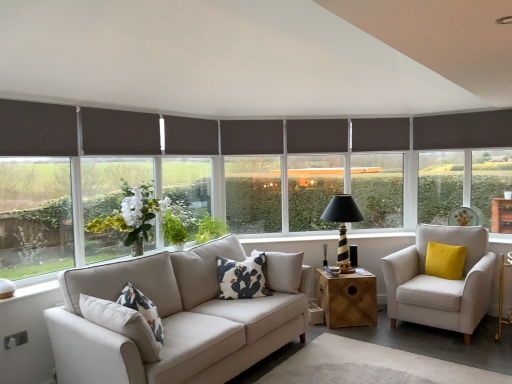
Measure the distance between point [244,283] and camera.

Point [244,283] and camera are 3.66 meters apart.

What are the coordinates of `white matte vase at center` in the screenshot? It's located at (132, 214).

In order to click on dark gray roller blind at center, the 2th window screen when ordered from left to right in this screenshot , I will do `click(253, 194)`.

In the image, is light beige fabric armchair at right on the left side or the right side of yellow velvet pillow at right, which is the first pillow in back-to-front order?

Based on their positions, light beige fabric armchair at right is located to the left of yellow velvet pillow at right, which is the first pillow in back-to-front order.

The width and height of the screenshot is (512, 384). I want to click on pillow located on the right of light beige fabric armchair at right, so click(x=445, y=260).

Is light beige fabric armchair at right turned away from yellow velvet pillow at right, which appears as the second pillow when viewed from the left?

Yes, yellow velvet pillow at right, which appears as the second pillow when viewed from the left, is at the back of light beige fabric armchair at right.

Who is taller, white cotton cushion at center, acting as the first pillow starting from the left, or wooden cube at center?

Standing taller between the two is white cotton cushion at center, acting as the first pillow starting from the left.

From a real-world perspective, between white cotton cushion at center, acting as the first pillow starting from the left, and wooden cube at center, who is vertically lower?

wooden cube at center is physically lower.

Based on the photo, which is closer to the camera, (241, 285) or (362, 280)?

Point (241, 285) is positioned closer to the camera compared to point (362, 280).

Is white cotton cushion at center, the 2th pillow positioned from the right, situated inside wooden cube at center or outside?

white cotton cushion at center, the 2th pillow positioned from the right, is outside wooden cube at center.

In the image, is yellow velvet pillow at right, the first pillow viewed from the right, positioned in front of or behind black striped wood table lamp at center?

yellow velvet pillow at right, the first pillow viewed from the right, is in front of black striped wood table lamp at center.

From the image's perspective, which one is positioned lower, yellow velvet pillow at right, which appears as the second pillow when viewed from the left, or black striped wood table lamp at center?

yellow velvet pillow at right, which appears as the second pillow when viewed from the left, from the image's perspective.

Is yellow velvet pillow at right, which is the first pillow in back-to-front order, not close to black striped wood table lamp at center?

They are positioned close to each other.

What are the coordinates of `pillow on the right of black striped wood table lamp at center` in the screenshot? It's located at pos(445,260).

Does point (438, 273) appear closer or farther from the camera than point (223, 259)?

Point (438, 273) appears to be farther away from the viewer than point (223, 259).

Is yellow velvet pillow at right, which is the first pillow in back-to-front order, bigger than white cotton cushion at center, the 2th pillow positioned from the right?

No, yellow velvet pillow at right, which is the first pillow in back-to-front order, is not bigger than white cotton cushion at center, the 2th pillow positioned from the right.

Is yellow velvet pillow at right, which is the first pillow in back-to-front order, positioned far away from white cotton cushion at center, acting as the 1th pillow starting from the front?

Indeed, yellow velvet pillow at right, which is the first pillow in back-to-front order, is not near white cotton cushion at center, acting as the 1th pillow starting from the front.

From a real-world perspective, is yellow velvet pillow at right, which is counted as the second pillow, starting from the front, located higher than white cotton cushion at center, the second pillow when ordered from back to front?

No, from a real-world perspective, yellow velvet pillow at right, which is counted as the second pillow, starting from the front, is not above white cotton cushion at center, the second pillow when ordered from back to front.

Can you confirm if dark gray roller blind at center, which is the 2th window screen from front to back, is bigger than wooden cube at center?

No.

Does dark gray roller blind at center, acting as the 1th window screen starting from the right, have a lesser width compared to wooden cube at center?

Correct, the width of dark gray roller blind at center, acting as the 1th window screen starting from the right, is less than that of wooden cube at center.

Considering the positions of point (271, 179) and point (328, 311), is point (271, 179) closer or farther from the camera than point (328, 311)?

Clearly, point (271, 179) is more distant from the camera than point (328, 311).

Can you confirm if black striped wood table lamp at center is smaller than wooden cube at center?

No.

Would you consider black striped wood table lamp at center to be distant from wooden cube at center?

No, black striped wood table lamp at center is not far away from wooden cube at center.

From their relative heights in the image, would you say black striped wood table lamp at center is taller or shorter than wooden cube at center?

black striped wood table lamp at center is taller than wooden cube at center.

Image resolution: width=512 pixels, height=384 pixels. I want to click on table on the left of black striped wood table lamp at center, so click(347, 298).

From a real-world perspective, relative to dark gray matte window frame at center, is yellow velvet pillow at right, which is counted as the second pillow, starting from the front, vertically above or below?

Clearly, from a real-world perspective, yellow velvet pillow at right, which is counted as the second pillow, starting from the front, is below dark gray matte window frame at center.

Considering the points (448, 253) and (395, 180), which point is behind, point (448, 253) or point (395, 180)?

The point (395, 180) is more distant.

Considering the sizes of objects yellow velvet pillow at right, which is counted as the second pillow, starting from the front, and dark gray matte window frame at center in the image provided, who is bigger, yellow velvet pillow at right, which is counted as the second pillow, starting from the front, or dark gray matte window frame at center?

With larger size is dark gray matte window frame at center.

At what (x,y) coordinates should I click in order to perform the action: click on pillow to the right of light beige fabric armchair at right. Please return your answer as a coordinate pair (x, y). The image size is (512, 384). Looking at the image, I should click on (445, 260).

Where is `table beneath the white cotton cushion at center, the 2th pillow positioned from the right (from a real-world perspective)`? The width and height of the screenshot is (512, 384). table beneath the white cotton cushion at center, the 2th pillow positioned from the right (from a real-world perspective) is located at coordinates (347, 298).

From the picture: Which object lies further to the anchor point dark gray roller blind at center, acting as the 1th window screen starting from the right, white matte vase at center or yellow velvet pillow at right, which is counted as the second pillow, starting from the front?

Among the two, yellow velvet pillow at right, which is counted as the second pillow, starting from the front, is located further to dark gray roller blind at center, acting as the 1th window screen starting from the right.

Estimate the real-world distances between objects in this image. Which object is further from dark gray roller blind at left, the first window screen viewed from the left, dark brown roller blind at center or wooden cube at center?

Among the two, dark brown roller blind at center is located further to dark gray roller blind at left, the first window screen viewed from the left.

From the image, which object appears to be farther from dark brown roller blind at center, black striped wood table lamp at center or light beige fabric armchair at right?

light beige fabric armchair at right.

In the scene shown: From the image, which object appears to be farther from white cotton cushion at center, the second pillow when ordered from back to front, light beige fabric armchair at right or dark gray roller blind at left, the first window screen viewed from the left?

The object further to white cotton cushion at center, the second pillow when ordered from back to front, is light beige fabric armchair at right.

Based on their spatial positions, is dark gray roller blind at left, positioned as the second window screen in right-to-left order, or black striped wood table lamp at center closer to dark brown roller blind at center?

Based on the image, black striped wood table lamp at center appears to be nearer to dark brown roller blind at center.

From the image, which object appears to be nearer to wooden cube at center, dark brown roller blind at center or dark gray roller blind at left, which is the second window screen in back-to-front order?

dark brown roller blind at center.

Considering their positions, is wooden cube at center positioned further to black striped wood table lamp at center than dark brown roller blind at center?

dark brown roller blind at center.

Based on their spatial positions, is white matte vase at center or dark gray matte window frame at center further from black striped wood table lamp at center?

white matte vase at center.

The width and height of the screenshot is (512, 384). Find the location of `table situated between white cotton cushion at center, acting as the 1th pillow starting from the front, and light beige fabric armchair at right from left to right`. table situated between white cotton cushion at center, acting as the 1th pillow starting from the front, and light beige fabric armchair at right from left to right is located at coordinates (347, 298).

This screenshot has width=512, height=384. What are the coordinates of `table lamp between white cotton cushion at center, acting as the first pillow starting from the left, and dark brown roller blind at center in the front-back direction` in the screenshot? It's located at (342, 225).

You are a GUI agent. You are given a task and a screenshot of the screen. Output one action in this format:
    pyautogui.click(x=<x>, y=<y>)
    Task: Click on the table between white matte vase at center and yellow velvet pillow at right, which is the first pillow in back-to-front order
    The image size is (512, 384).
    Given the screenshot: What is the action you would take?
    pyautogui.click(x=347, y=298)

The width and height of the screenshot is (512, 384). What are the coordinates of `table between dark gray roller blind at center, the 2th window screen when ordered from left to right, and light beige fabric armchair at right` in the screenshot? It's located at (347, 298).